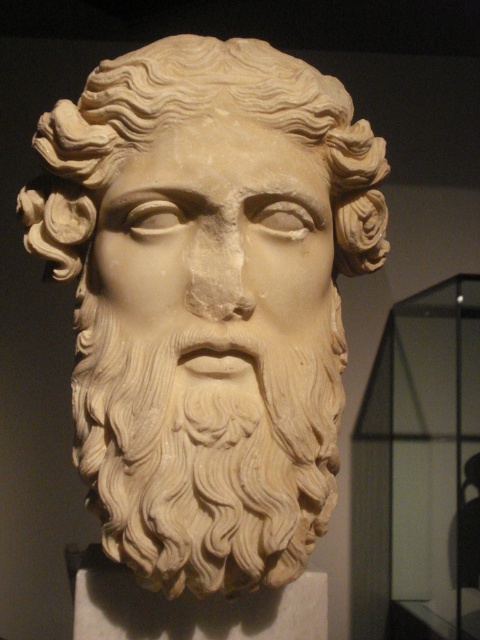
You are an art conservator examining the classical marble sculpture. You notice the white marble head at center and the white marble face at center. Which part of the sculpture is taller?

The white marble head at center is taller than the white marble face at center.

In the scene shown: You are an art conservator examining the classical marble bust. You notice two parts of the sculpture labeled as the white marble head at center and the white marble face at center. From the perspective of someone standing in front of the bust, which part is positioned lower?

The white marble head at center is located below the white marble face at center, so the white marble head at center is positioned lower.